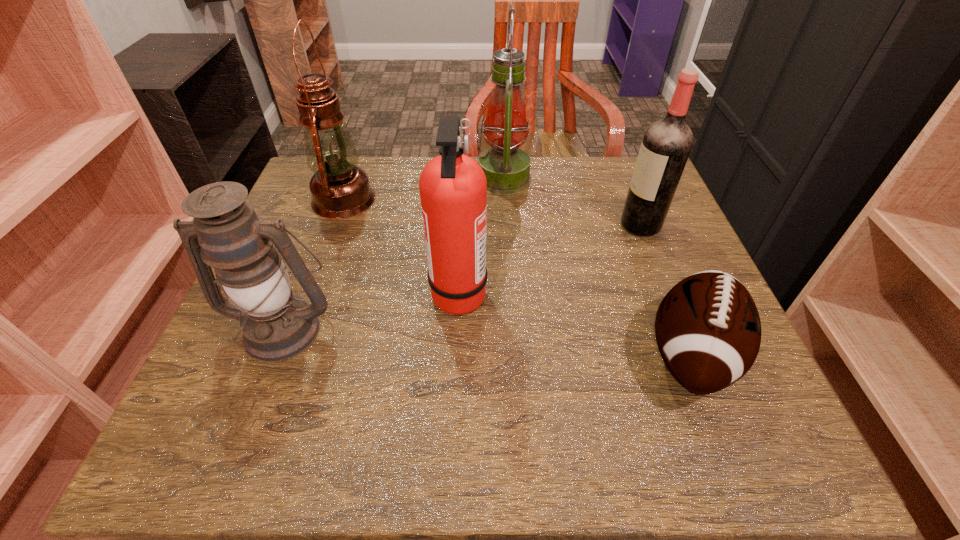
Identify the location of the rightmost oil lamp. (507, 168).

The image size is (960, 540). In order to click on fire extinguisher in this screenshot , I will do `click(453, 188)`.

At what (x,y) coordinates should I click in order to perform the action: click on liquor. Please return your answer as a coordinate pair (x, y). Looking at the image, I should click on tap(666, 145).

The width and height of the screenshot is (960, 540). In order to click on the nearest oil lamp in this screenshot , I will do `click(226, 234)`.

Locate an element on the screen. the shortest object is located at coordinates (708, 330).

Locate an element on the screen. Image resolution: width=960 pixels, height=540 pixels. free region located 0.370m on the left of the rightmost oil lamp is located at coordinates pos(334,179).

The width and height of the screenshot is (960, 540). Identify the location of blank space located on the handle side of the fire extinguisher. (654, 293).

Find the location of a particular element. vacant space located on the front-facing side of the liquor is located at coordinates tap(477, 225).

Where is `vacant point located on the front-facing side of the liquor`? The height and width of the screenshot is (540, 960). vacant point located on the front-facing side of the liquor is located at coordinates (447, 225).

Locate an element on the screen. vacant region located 0.370m on the front-facing side of the liquor is located at coordinates (460, 225).